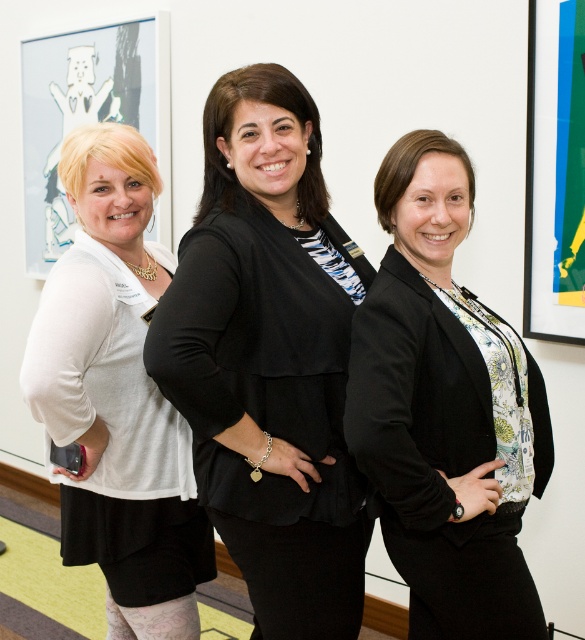
You are standing in the professional setting shown in the image. There are two points marked in the scene. Which point, point (449, 381) or point (180, 502), is closer to you?

Point (449, 381) is closer to the viewer than point (180, 502).